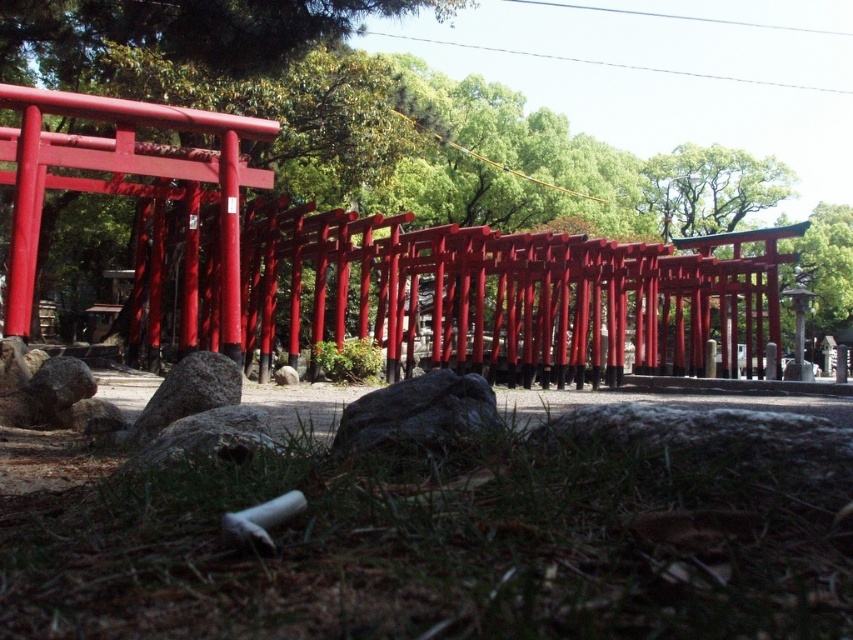
You are a photographer standing at the entrance of the torii gates. You want to take a photo that includes both the green grass at lower center and the gray rough rock at center. Which object should you focus on first to ensure both are in sharp focus?

Since the green grass at lower center is closer to the viewer than the gray rough rock at center, you should focus on the green grass at lower center first. This way, the gray rough rock at center will naturally fall into focus as it is further away, ensuring both elements are sharp in the photograph.

You are a hiker who wants to place a small flag exactly between the gray rough rock at center and the gray rough rock at lower center. Based on their positions, where should you place the flag?

The gray rough rock at center is located above the gray rough rock at lower center, so you should place the flag between them along the vertical axis, halfway between their positions.